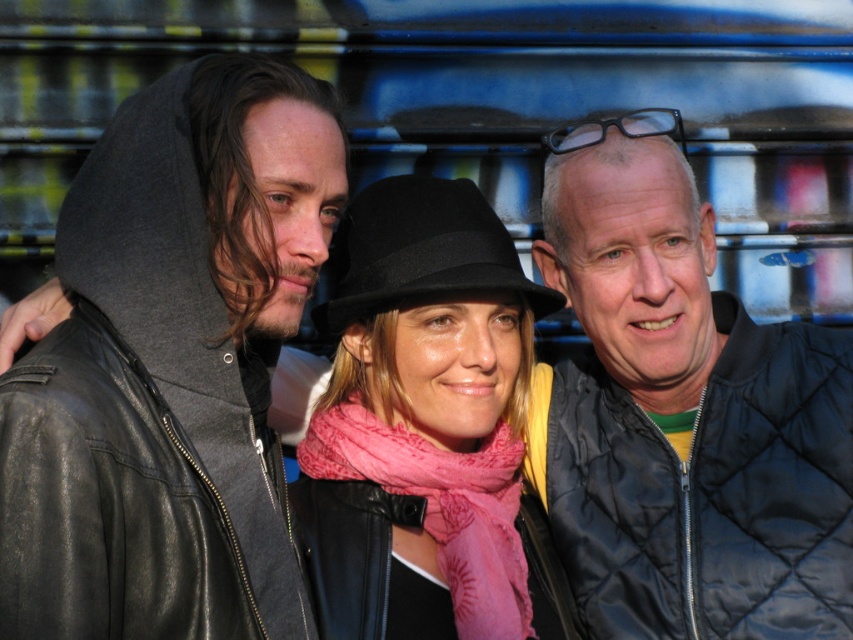
You are a photographer standing 10 feet away from the camera. You want to adjust the focus to capture the pink silk scarf at center clearly. Is the scarf within the camera focus range if the camera has a minimum focus distance of 8 feet?

The distance between the pink silk scarf at center and the camera is 7.98 feet, which is less than the camera minimum focus distance of 8 feet. Therefore, the camera cannot focus on the pink silk scarf at center because it is too close.

In the scene shown: You are a photographer trying to capture a group photo of the three people. You notice two points marked in the scene at coordinates point (x=107, y=584) and point (x=485, y=342). Which point is closer to the camera?

Point (x=107, y=584) is in front of point (x=485, y=342), so it is closer to the camera.